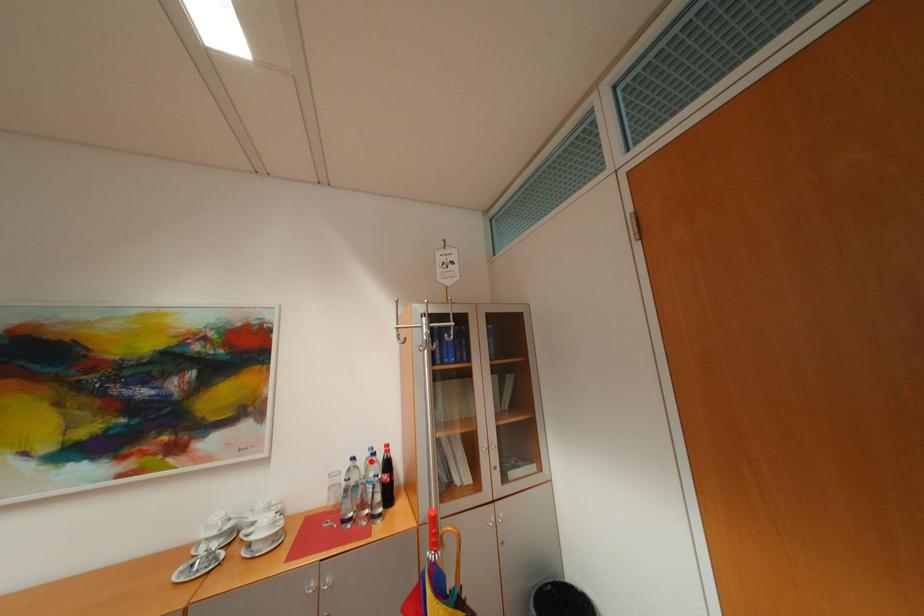
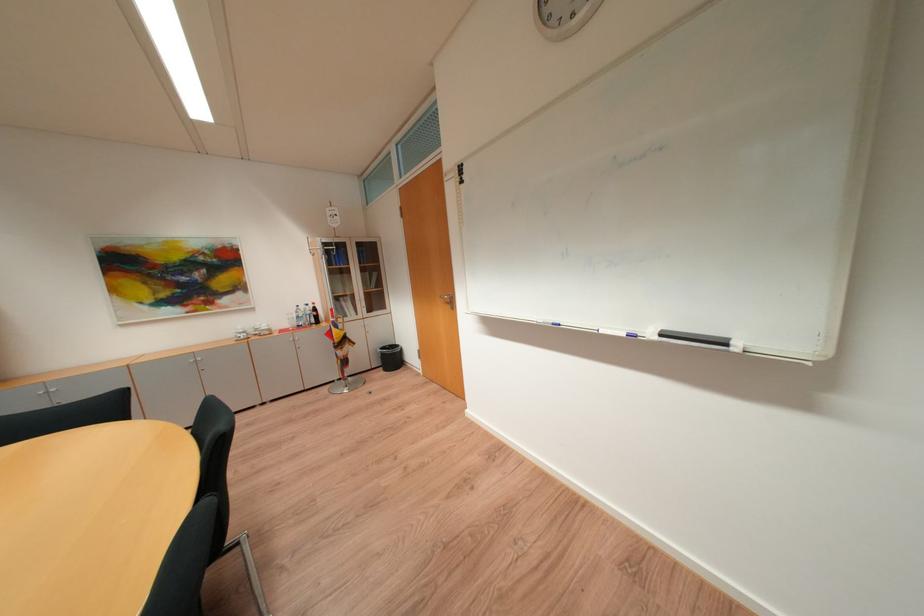
Question: I am providing you with two images of the same scene from different viewpoints. In image1, a red point is highlighted. Considering the same 3D point in image2, which of the following is correct?

Choices:
 (A) It is closer
 (B) It is farther

Answer: (A)